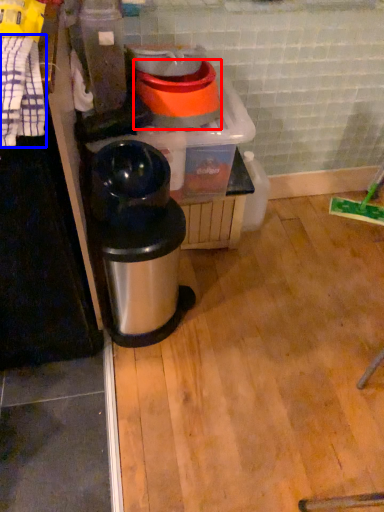
Question: Which of the following is the closest to the observer, appliance (highlighted by a red box) or laundry (highlighted by a blue box)?

Choices:
 (A) appliance
 (B) laundry

Answer: (B)